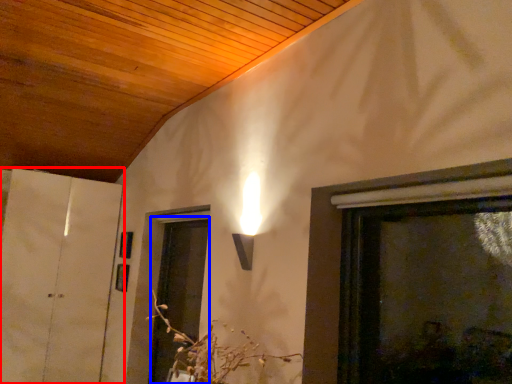
Question: Which of the following is the closest to the observer, door (highlighted by a red box) or screen door (highlighted by a blue box)?

Choices:
 (A) door
 (B) screen door

Answer: (B)